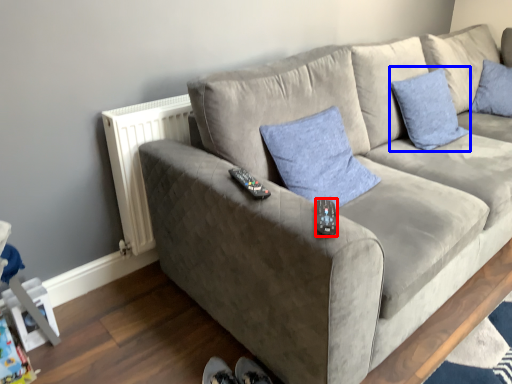
Question: Which object is closer to the camera taking this photo, remote (highlighted by a red box) or pillow (highlighted by a blue box)?

Choices:
 (A) remote
 (B) pillow

Answer: (A)